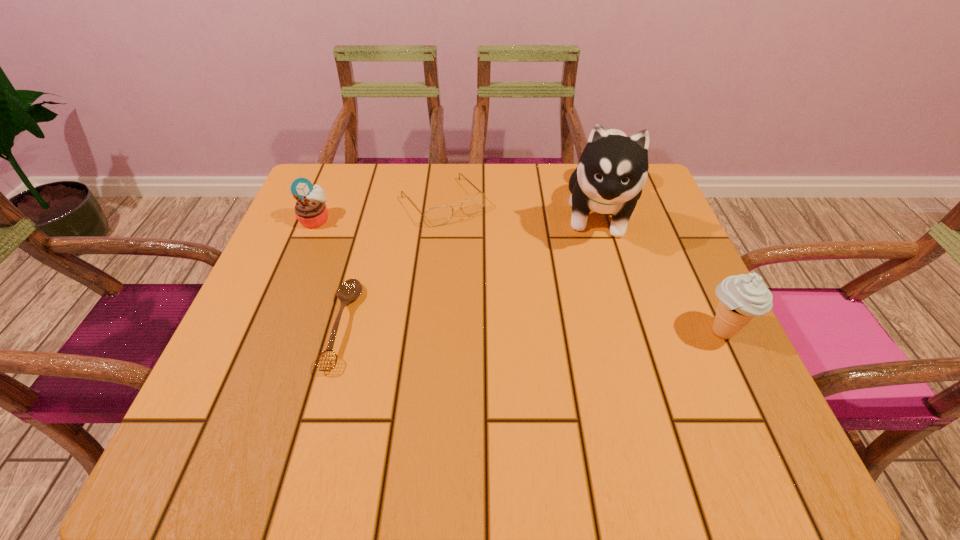
Find the location of a particular element. This screenshot has height=540, width=960. vacant region that satisfies the following two spatial constraints: 1. on the front side of the third object from right to left; 2. on the right side of the puppy is located at coordinates (442, 212).

Locate an element on the screen. The height and width of the screenshot is (540, 960). vacant area in the image that satisfies the following two spatial constraints: 1. on the front side of the icecream; 2. on the left side of the ladle is located at coordinates (341, 332).